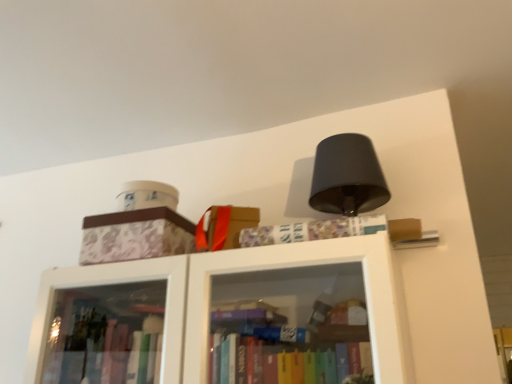
The width and height of the screenshot is (512, 384). What do you see at coordinates (135, 236) in the screenshot? I see `patterned cardboard box at upper left` at bounding box center [135, 236].

In order to face patterned cardboard box at upper left, should I rotate leftwards or rightwards?

Turn left by 14.225 degrees to look at patterned cardboard box at upper left.

I want to click on patterned cardboard box at upper left, so click(x=135, y=236).

This screenshot has width=512, height=384. Describe the element at coordinates (312, 230) in the screenshot. I see `patterned paper book at upper center` at that location.

The image size is (512, 384). Identify the location of patterned paper book at upper center. (312, 230).

Locate an element on the screen. The height and width of the screenshot is (384, 512). patterned cardboard box at upper left is located at coordinates (135, 236).

Based on the photo, which is more to the left, patterned cardboard box at upper left or patterned paper book at upper center?

patterned cardboard box at upper left.

Is patterned cardboard box at upper left in front of patterned paper book at upper center?

No, patterned cardboard box at upper left is further to the viewer.

Looking at this image, which is nearer, (117, 238) or (259, 237)?

Point (117, 238) appears to be farther away from the viewer than point (259, 237).

From the image's perspective, which one is positioned higher, patterned cardboard box at upper left or patterned paper book at upper center?

From the image's view, patterned paper book at upper center is above.

From a real-world perspective, is patterned cardboard box at upper left positioned over patterned paper book at upper center based on gravity?

Yes, from a real-world perspective, patterned cardboard box at upper left is above patterned paper book at upper center.

Looking at their sizes, would you say patterned cardboard box at upper left is wider or thinner than patterned paper book at upper center?

Considering their sizes, patterned cardboard box at upper left looks broader than patterned paper book at upper center.

From their relative heights in the image, would you say patterned cardboard box at upper left is taller or shorter than patterned paper book at upper center?

patterned cardboard box at upper left is taller than patterned paper book at upper center.

Who is bigger, patterned cardboard box at upper left or patterned paper book at upper center?

patterned cardboard box at upper left.

Would you say patterned paper book at upper center is part of patterned cardboard box at upper left's contents?

No, patterned paper book at upper center is not a part of patterned cardboard box at upper left.

Is patterned cardboard box at upper left not near patterned paper book at upper center?

patterned cardboard box at upper left is near patterned paper book at upper center, not far away.

Could you tell me if patterned cardboard box at upper left is facing patterned paper book at upper center?

No, patterned cardboard box at upper left does not turn towards patterned paper book at upper center.

How different are the orientations of patterned cardboard box at upper left and patterned paper book at upper center in degrees?

0.000264 degrees.

You are a GUI agent. You are given a task and a screenshot of the screen. Output one action in this format:
    pyautogui.click(x=<x>, y=<y>)
    Task: Click on the book that appears below the patterned cardboard box at upper left (from a real-world perspective)
    Image resolution: width=512 pixels, height=384 pixels.
    Given the screenshot: What is the action you would take?
    pyautogui.click(x=312, y=230)

Considering the positions of objects patterned paper book at upper center and patterned cardboard box at upper left in the image provided, who is more to the right, patterned paper book at upper center or patterned cardboard box at upper left?

patterned paper book at upper center.

Considering the relative positions of patterned paper book at upper center and patterned cardboard box at upper left in the image provided, is patterned paper book at upper center behind patterned cardboard box at upper left?

No, it is in front of patterned cardboard box at upper left.

Is point (371, 231) positioned before point (113, 223)?

Yes, it is in front of point (113, 223).

From the image's perspective, which is above, patterned paper book at upper center or patterned cardboard box at upper left?

patterned paper book at upper center, from the image's perspective.

From a real-world perspective, is patterned paper book at upper center physically above patterned cardboard box at upper left?

No, from a real-world perspective, patterned paper book at upper center is not over patterned cardboard box at upper left

Considering the sizes of objects patterned paper book at upper center and patterned cardboard box at upper left in the image provided, who is wider, patterned paper book at upper center or patterned cardboard box at upper left?

With larger width is patterned cardboard box at upper left.

Considering the relative sizes of patterned paper book at upper center and patterned cardboard box at upper left in the image provided, is patterned paper book at upper center taller than patterned cardboard box at upper left?

No.

Looking at this image, considering the relative sizes of patterned paper book at upper center and patterned cardboard box at upper left in the image provided, is patterned paper book at upper center smaller than patterned cardboard box at upper left?

Indeed, patterned paper book at upper center has a smaller size compared to patterned cardboard box at upper left.

Is patterned paper book at upper center inside the boundaries of patterned cardboard box at upper left, or outside?

patterned paper book at upper center exists outside the volume of patterned cardboard box at upper left.

Is patterned paper book at upper center far away from patterned cardboard box at upper left?

That's not correct — patterned paper book at upper center is a little close to patterned cardboard box at upper left.

Is patterned paper book at upper center facing towards patterned cardboard box at upper left?

No, patterned paper book at upper center is not aimed at patterned cardboard box at upper left.

The width and height of the screenshot is (512, 384). In order to click on book in front of the patterned cardboard box at upper left in this screenshot , I will do `click(312, 230)`.

Locate an element on the screen. The width and height of the screenshot is (512, 384). book in front of the patterned cardboard box at upper left is located at coordinates (312, 230).

In the image, there is a patterned cardboard box at upper left. In order to click on book below it (from a real-world perspective) in this screenshot , I will do `click(312, 230)`.